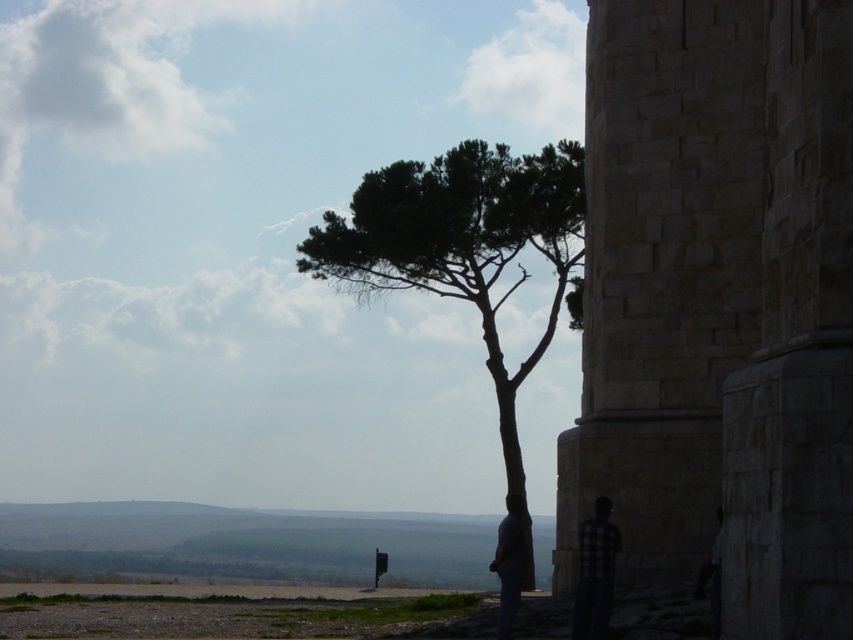
Looking at this image, you are a photographer trying to capture a photo of the green leafy tree at center and the dark blue jeans at lower center. Since you want both subjects to be in focus, you need to know which one is taller. Can you tell me which object is taller?

The green leafy tree at center is much taller than the dark blue jeans at lower center, so you should focus on the green leafy tree at center first to ensure both are in focus.